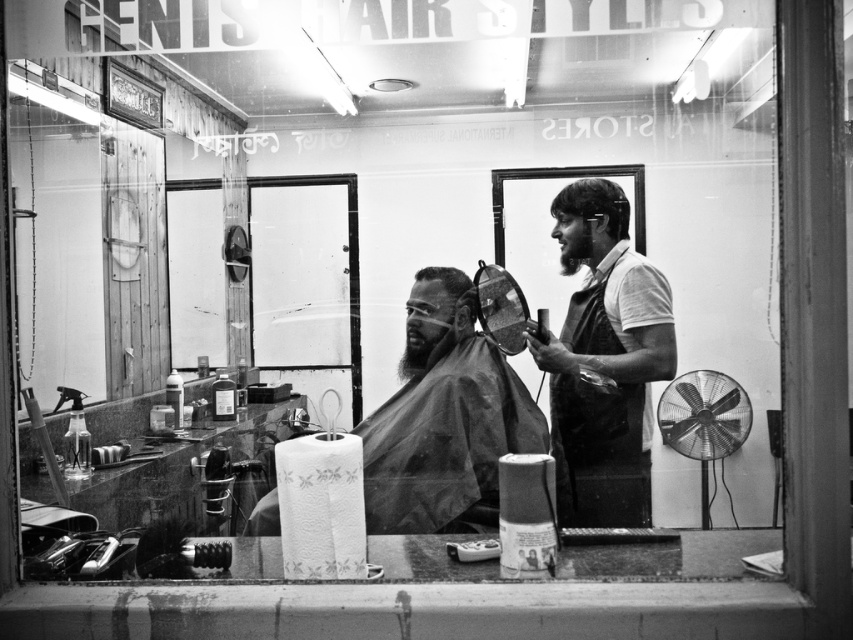
Can you confirm if smooth black shirt at center is positioned to the left of short hair at center?

Incorrect, smooth black shirt at center is not on the left side of short hair at center.

Does smooth black shirt at center appear under short hair at center?

Yes, smooth black shirt at center is below short hair at center.

You are a GUI agent. You are given a task and a screenshot of the screen. Output one action in this format:
    pyautogui.click(x=<x>, y=<y>)
    Task: Click on the smooth black shirt at center
    The width and height of the screenshot is (853, 640).
    Given the screenshot: What is the action you would take?
    pyautogui.click(x=605, y=356)

Is point (601, 493) closer to viewer compared to point (453, 301)?

No.

Can you confirm if black fabric apron at right is thinner than short hair at center?

No, black fabric apron at right is not thinner than short hair at center.

Measure the distance between black fabric apron at right and camera.

They are 8.31 feet apart.

Where is `black fabric apron at right`? Image resolution: width=853 pixels, height=640 pixels. black fabric apron at right is located at coordinates (599, 452).

Who is positioned more to the right, smooth black shirt at center or black fabric apron at right?

smooth black shirt at center

Can you confirm if smooth black shirt at center is wider than black fabric apron at right?

Indeed, smooth black shirt at center has a greater width compared to black fabric apron at right.

Which is behind, point (622, 346) or point (604, 397)?

Point (604, 397)

What are the coordinates of `smooth black shirt at center` in the screenshot? It's located at (605, 356).